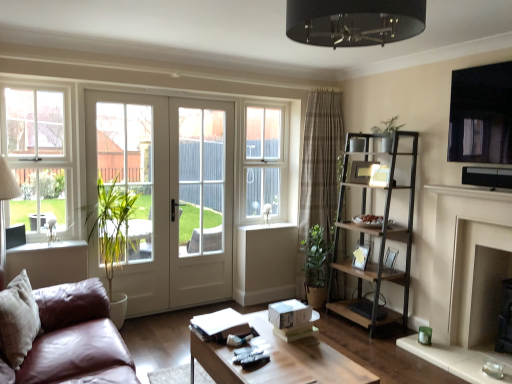
Question: From the image's perspective, is white glossy door at center located beneath matte black picture frame at right?

Choices:
 (A) no
 (B) yes

Answer: (A)

Question: Does white glossy door at center have a larger size compared to matte black picture frame at right?

Choices:
 (A) yes
 (B) no

Answer: (A)

Question: Can you confirm if white glossy door at center is thinner than matte black picture frame at right?

Choices:
 (A) yes
 (B) no

Answer: (A)

Question: Is white glossy door at center further to camera compared to matte black picture frame at right?

Choices:
 (A) yes
 (B) no

Answer: (B)

Question: From a real-world perspective, is white glossy door at center located higher than matte black picture frame at right?

Choices:
 (A) yes
 (B) no

Answer: (A)

Question: Relative to beige fabric pillow at lower left, is brown textured curtain at center in front or behind?

Choices:
 (A) front
 (B) behind

Answer: (B)

Question: Considering the positions of brown textured curtain at center and beige fabric pillow at lower left in the image, is brown textured curtain at center bigger or smaller than beige fabric pillow at lower left?

Choices:
 (A) big
 (B) small

Answer: (A)

Question: In terms of width, does brown textured curtain at center look wider or thinner when compared to beige fabric pillow at lower left?

Choices:
 (A) wide
 (B) thin

Answer: (A)

Question: In terms of height, does brown textured curtain at center look taller or shorter compared to beige fabric pillow at lower left?

Choices:
 (A) tall
 (B) short

Answer: (A)

Question: In terms of size, does matte black tv at upper right appear bigger or smaller than matte black picture frame at right?

Choices:
 (A) big
 (B) small

Answer: (A)

Question: From a real-world perspective, is matte black tv at upper right above or below matte black picture frame at right?

Choices:
 (A) below
 (B) above

Answer: (B)

Question: Is matte black tv at upper right situated inside matte black picture frame at right or outside?

Choices:
 (A) inside
 (B) outside

Answer: (B)

Question: Considering the positions of matte black tv at upper right and matte black picture frame at right in the image, is matte black tv at upper right wider or thinner than matte black picture frame at right?

Choices:
 (A) thin
 (B) wide

Answer: (A)

Question: Is matte black picture frame at right in front of or behind green matte plant at upper right in the image?

Choices:
 (A) front
 (B) behind

Answer: (B)

Question: From a real-world perspective, relative to green matte plant at upper right, is matte black picture frame at right vertically above or below?

Choices:
 (A) above
 (B) below

Answer: (B)